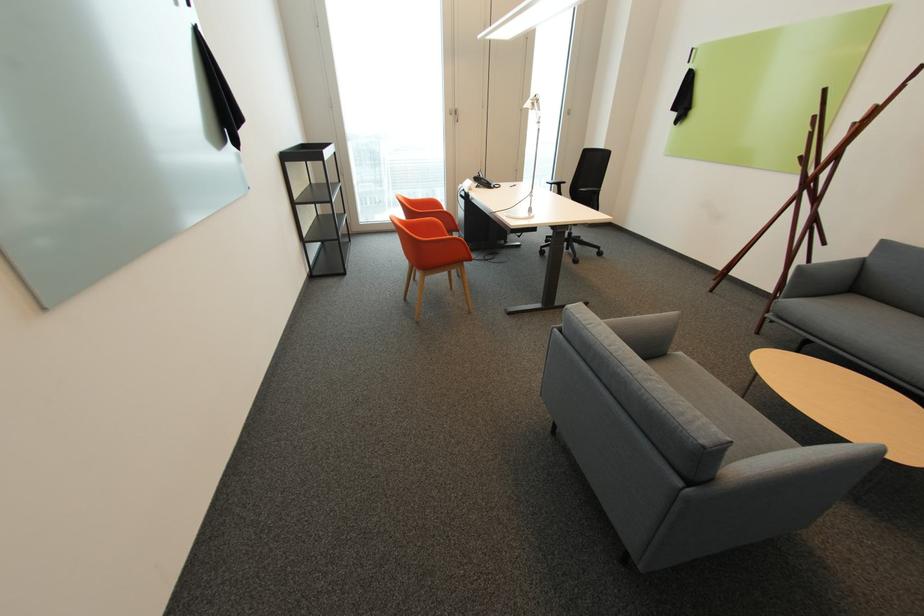
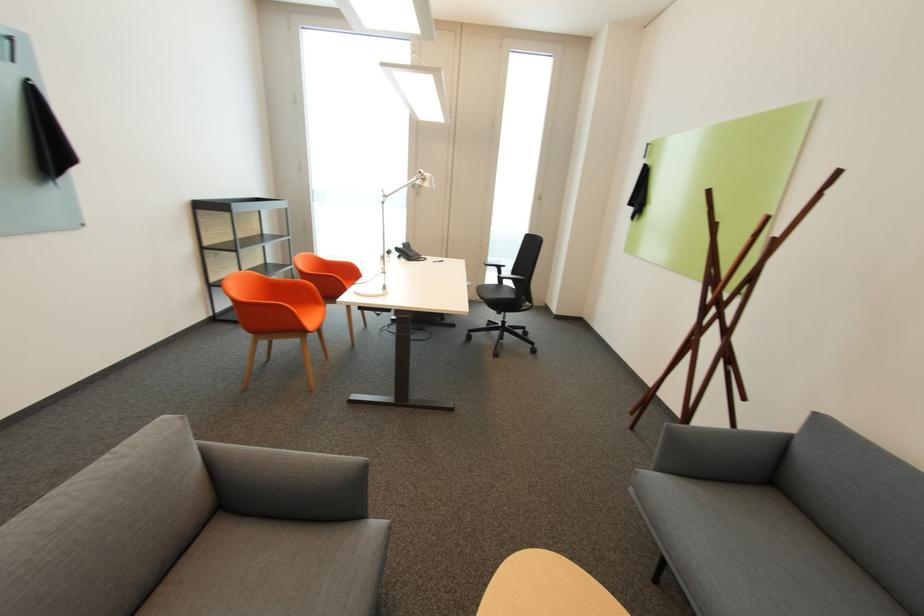
Where in the second image is the point corresponding to pixel 721 280 from the first image?

(638, 414)